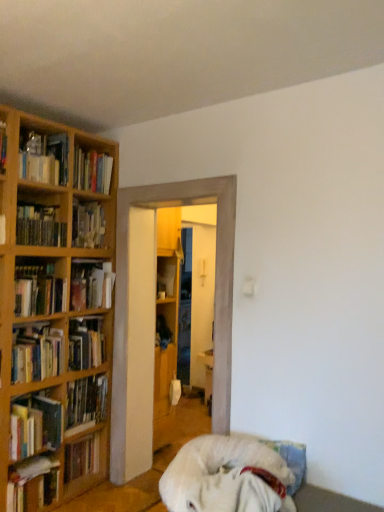
Question: Choose the correct answer: Is wooden cabinet at center inside hardcover book at left, the 4th book from the bottom, or outside it?

Choices:
 (A) inside
 (B) outside

Answer: (B)

Question: In terms of size, does wooden cabinet at center appear bigger or smaller than hardcover book at left, the 4th book from the bottom?

Choices:
 (A) big
 (B) small

Answer: (B)

Question: Which is farther from the wooden cabinet at center?

Choices:
 (A) wooden bookshelf at left
 (B) wooden bookshelf at left, which ranks as the sixth book in bottom-to-top order
 (C) hardcover book at left, which is counted as the 11th book, starting from the top
 (D) hardcover book at left, the third book when ordered from top to bottom
 (E) hardcover book at left, which appears as the 5th book when ordered from the bottom

Answer: (C)

Question: Which object is positioned closest to the hardcover book at left, which appears as the seventh book when viewed from the top?

Choices:
 (A) matte wooden bookshelf at left, the eleventh book positioned from the bottom
 (B) white fluffy dog at lower center
 (C) hardcover book at left, the third book when ordered from top to bottom
 (D) hardcover book at left, acting as the 1th book starting from the bottom
 (E) hardcover book at left, arranged as the 7th book when ordered from the bottom

Answer: (E)